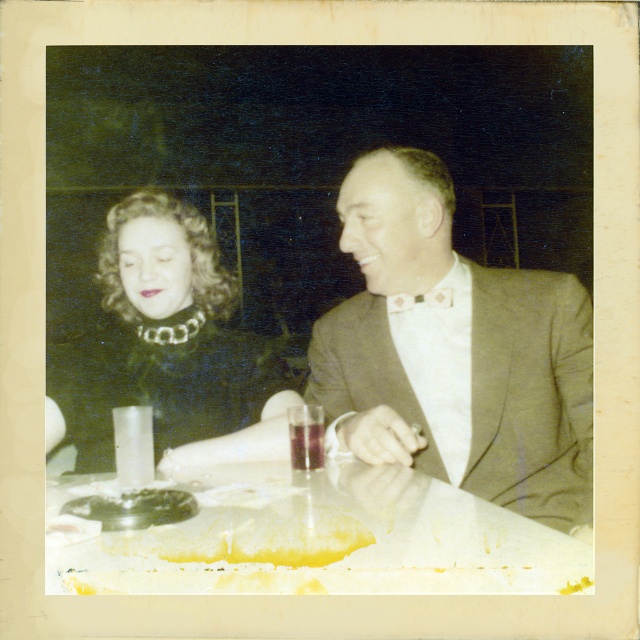
You are a guest at a formal event and notice two items on the table in front of you. You see the yellow wax at lower center and the translucent glass at table center. Which item is shorter in height?

The yellow wax at lower center is not as tall as the translucent glass at table center, so the yellow wax at lower center is shorter in height.

You are organizing a vintage clothing exhibition and need to display the green velvet dress at left and the white paper at center. According to the image, which object has a greater width?

The white paper at center might be wider than green velvet dress at left, so the white paper at center has a greater width.

You are a photographer trying to focus on the green velvet dress at left and the white paper at center. Which object should you adjust your camera focus on first to ensure both are in focus?

Since the white paper at center is closer to the viewer than the green velvet dress at left, you should first focus on the white paper at center to ensure both objects are in focus as the depth of field will naturally extend from the closer object to the farther one.